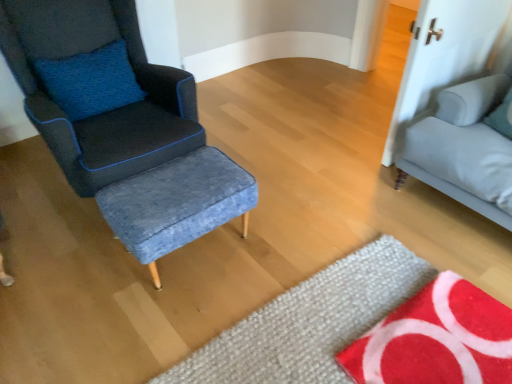
Find the location of a particular element. vacant space behind red textured mat at lower right, the first mat positioned from the right is located at coordinates (386, 276).